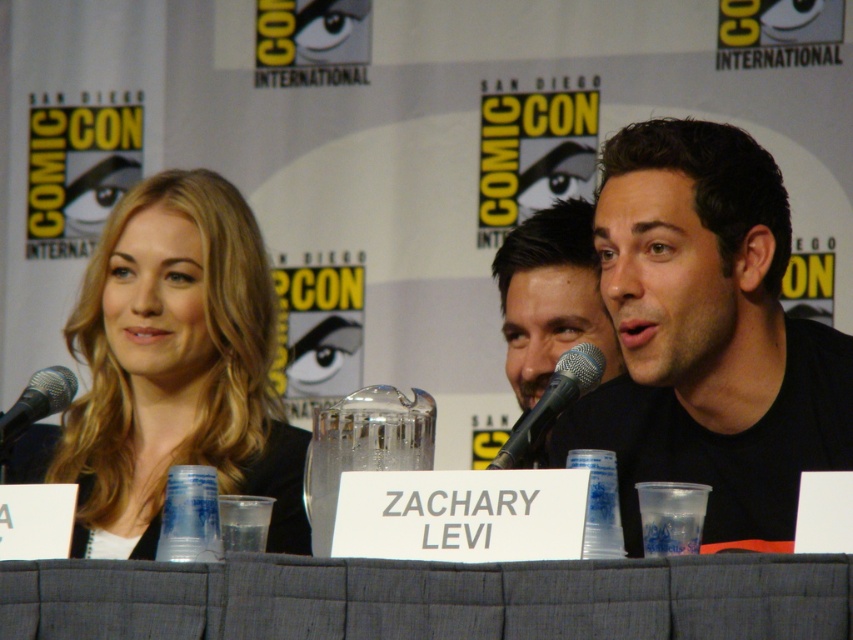
Question: Based on their relative distances, which object is farther from the smooth blonde hair at center?

Choices:
 (A) gray fabric table at center
 (B) black metallic microphone at left
 (C) smooth black shirt at center
 (D) black matte shirt at center

Answer: (A)

Question: Is black matte shirt at center further to the viewer compared to black metallic microphone at left?

Choices:
 (A) no
 (B) yes

Answer: (A)

Question: Does gray fabric table at center lie behind smooth blonde hair at center?

Choices:
 (A) no
 (B) yes

Answer: (A)

Question: Estimate the real-world distances between objects in this image. Which object is farther from the gray fabric table at center?

Choices:
 (A) black metallic microphone at left
 (B) smooth black shirt at center
 (C) smooth blonde hair at center

Answer: (B)

Question: Observing the image, what is the correct spatial positioning of gray fabric table at center in reference to black metallic microphone at center?

Choices:
 (A) right
 (B) left

Answer: (B)

Question: Which point is closer to the camera?

Choices:
 (A) smooth black shirt at center
 (B) black metallic microphone at center

Answer: (B)